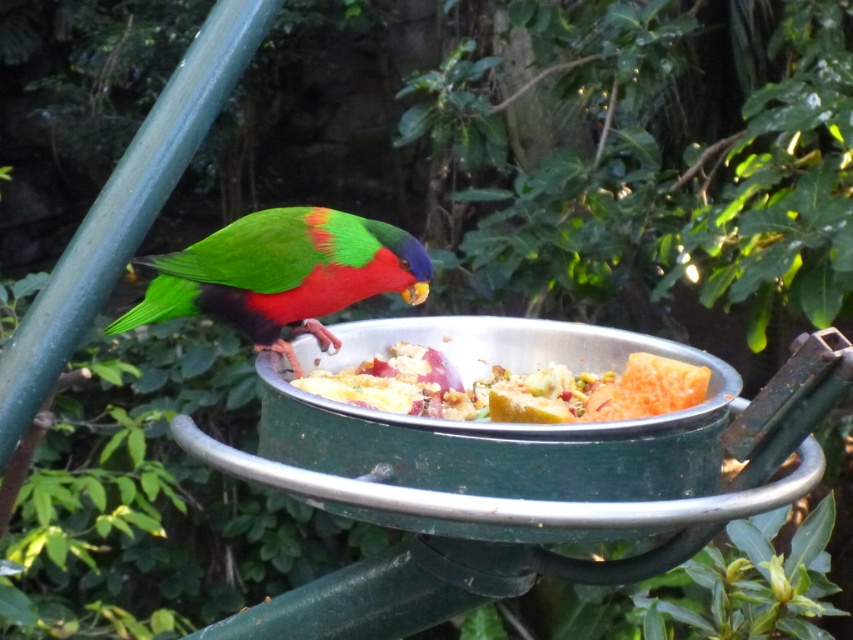
You are standing in the garden where the bird feeder is located. You notice two points marked in the scene. The first point is at coordinates point (310, 442) and the second is at point (260, 346). Which point is closer to you?

Point (310, 442) is in front of point (260, 346), so it is closer to you.

You are trying to determine the position of the metallic silver bird feeder at center and the green matte parrot at center in the image. Which object is located higher up?

The green matte parrot at center is located higher up than the metallic silver bird feeder at center.

You are a small toy bird that is 10 cm tall. You want to perch on the shiny metallic bowl at center like the green matte parrot at center. Can you fit under the bowl without hitting your head if the bowl is 8 cm tall?

The green matte parrot at center is taller than the shiny metallic bowl at center. Since the toy bird is 10 cm tall and the bowl is only 8 cm tall, the toy bird would hit its head if it tried to perch under the bowl.